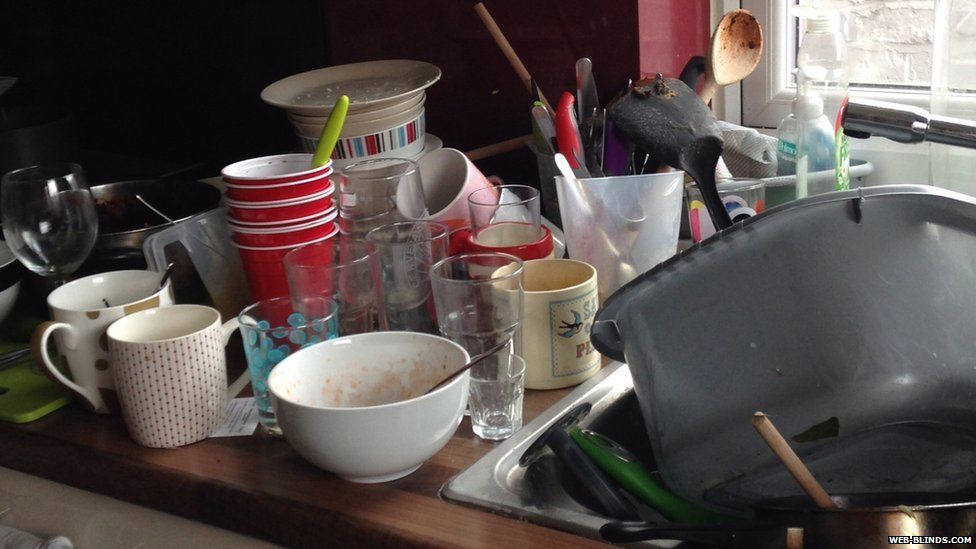
Where is `wooden spoon`? Image resolution: width=976 pixels, height=549 pixels. wooden spoon is located at coordinates (733, 61).